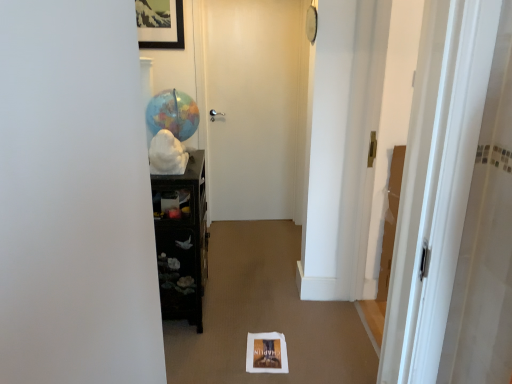
Question: From the image's perspective, is black glossy cabinet at left beneath matte globe at center?

Choices:
 (A) yes
 (B) no

Answer: (A)

Question: Is black glossy cabinet at left smaller than matte globe at center?

Choices:
 (A) no
 (B) yes

Answer: (A)

Question: From the image's perspective, would you say black glossy cabinet at left is positioned over matte globe at center?

Choices:
 (A) yes
 (B) no

Answer: (B)

Question: Is black glossy cabinet at left positioned with its back to matte globe at center?

Choices:
 (A) no
 (B) yes

Answer: (A)

Question: From a real-world perspective, is black glossy cabinet at left physically above matte globe at center?

Choices:
 (A) yes
 (B) no

Answer: (B)

Question: From the image's perspective, is black glossy cabinet at left positioned above or below wooden framed picture at upper center?

Choices:
 (A) below
 (B) above

Answer: (A)

Question: Looking at their shapes, would you say black glossy cabinet at left is wider or thinner than wooden framed picture at upper center?

Choices:
 (A) thin
 (B) wide

Answer: (B)

Question: Is point 199,314 closer or farther from the camera than point 154,16?

Choices:
 (A) closer
 (B) farther

Answer: (A)

Question: Based on their sizes in the image, would you say black glossy cabinet at left is bigger or smaller than wooden framed picture at upper center?

Choices:
 (A) big
 (B) small

Answer: (A)

Question: Relative to wooden framed picture at upper center, is matte globe at center in front or behind?

Choices:
 (A) behind
 (B) front

Answer: (B)

Question: In terms of width, does matte globe at center look wider or thinner when compared to wooden framed picture at upper center?

Choices:
 (A) thin
 (B) wide

Answer: (B)

Question: From a real-world perspective, relative to wooden framed picture at upper center, is matte globe at center vertically above or below?

Choices:
 (A) above
 (B) below

Answer: (B)

Question: Is matte globe at center bigger or smaller than wooden framed picture at upper center?

Choices:
 (A) big
 (B) small

Answer: (A)

Question: Is white matte door at center, which appears as the 1th door when viewed from the back, inside or outside of wooden framed picture at upper center?

Choices:
 (A) outside
 (B) inside

Answer: (A)

Question: Is white matte door at center, the second door when ordered from right to left, wider or thinner than wooden framed picture at upper center?

Choices:
 (A) wide
 (B) thin

Answer: (B)